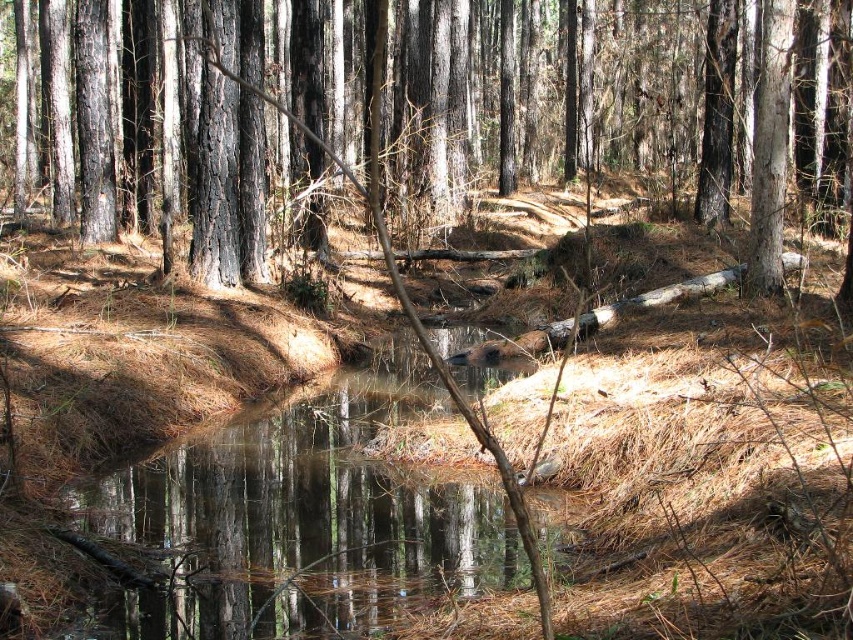
Question: Which of the following is the farthest from the observer?

Choices:
 (A) clear water at center
 (B) smooth bark tree at center

Answer: (B)

Question: Is smooth bark tree at center bigger than clear water at center?

Choices:
 (A) no
 (B) yes

Answer: (B)

Question: Is the position of smooth bark tree at center less distant than that of clear water at center?

Choices:
 (A) yes
 (B) no

Answer: (B)

Question: Is smooth bark tree at center to the right of clear water at center from the viewer's perspective?

Choices:
 (A) yes
 (B) no

Answer: (B)